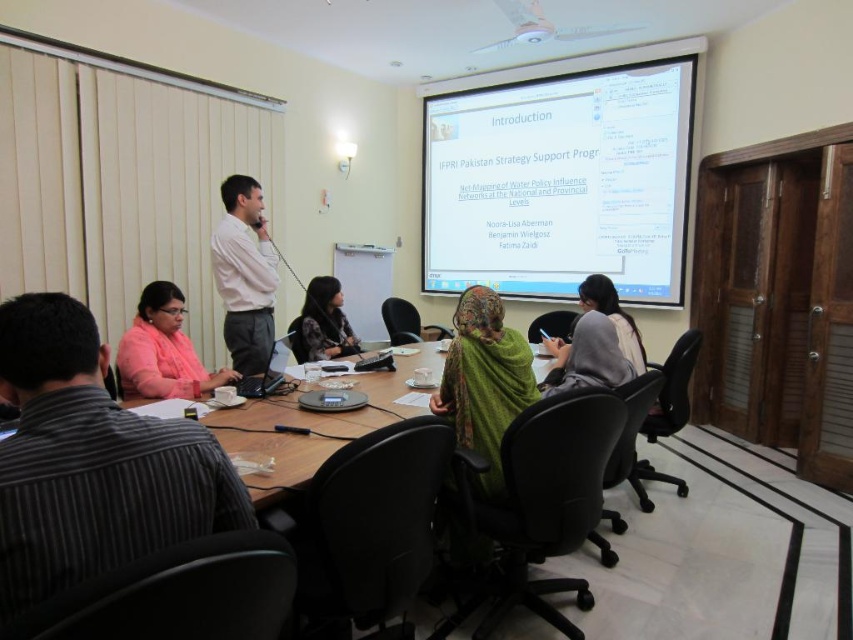
Question: Is striped shirt at lower left closer to the viewer compared to white shirt at center?

Choices:
 (A) no
 (B) yes

Answer: (B)

Question: Among these points, which one is farthest from the camera?

Choices:
 (A) (585, 289)
 (B) (311, 349)
 (C) (152, 324)
 (D) (549, 176)

Answer: (D)

Question: Which is nearer to the gray fabric jacket at center?

Choices:
 (A) green fabric headscarf at center
 (B) matte pink sweater at lower left
 (C) dark brown leather jacket at center
 (D) white glossy projection screen at upper center

Answer: (A)

Question: Which of the following is the closest to the observer?

Choices:
 (A) (526, 241)
 (B) (490, 474)
 (C) (231, 442)

Answer: (C)

Question: Does dark brown leather jacket at center have a smaller size compared to gray fabric jacket at center?

Choices:
 (A) no
 (B) yes

Answer: (B)

Question: Is wooden table at center behind dark brown leather jacket at center?

Choices:
 (A) no
 (B) yes

Answer: (A)